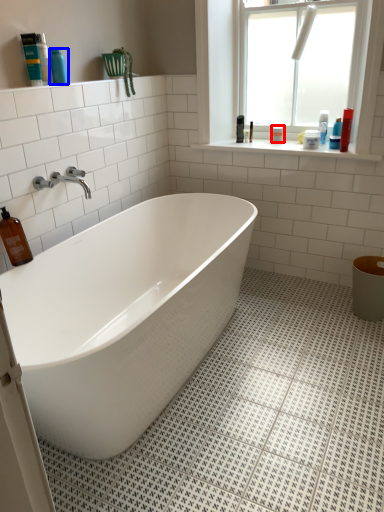
Question: Which point is closer to the camera, toiletry (highlighted by a red box) or toiletry (highlighted by a blue box)?

Choices:
 (A) toiletry
 (B) toiletry

Answer: (B)